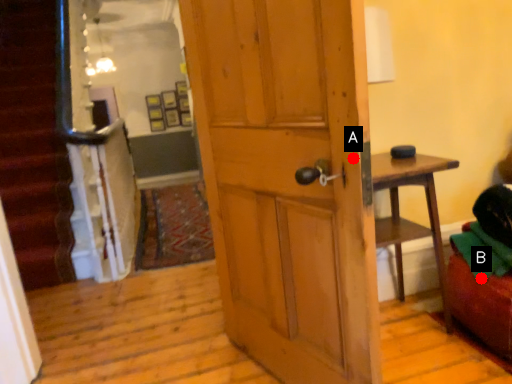
Question: Two points are circled on the image, labeled by A and B beside each circle. Which point is closer to the camera?

Choices:
 (A) A is closer
 (B) B is closer

Answer: (A)